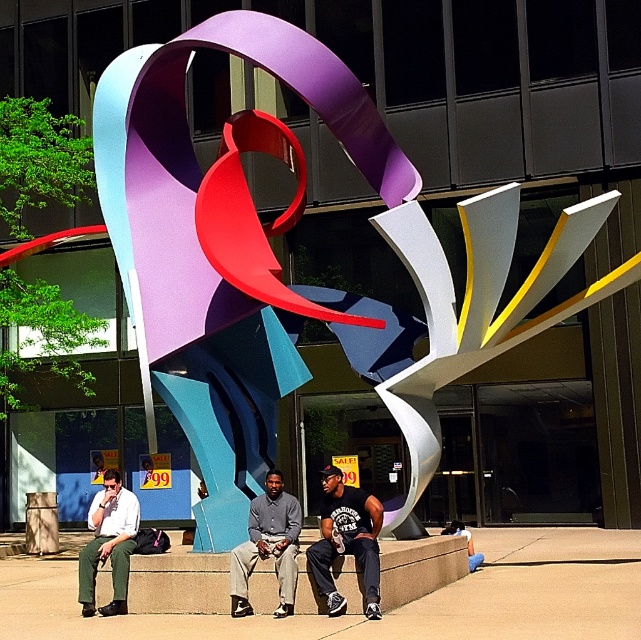
Question: Can you confirm if matte metallic abstract sculpture at center is positioned below gray shirt at center?

Choices:
 (A) no
 (B) yes

Answer: (A)

Question: Which of the following is the closest to the observer?

Choices:
 (A) [247, 525]
 (B) [178, 112]
 (C) [374, 497]

Answer: (A)

Question: Which object is positioned closest to the dark blue jeans at center?

Choices:
 (A) matte white shirt at left
 (B) matte metallic abstract sculpture at center

Answer: (A)

Question: Is matte metallic abstract sculpture at center to the left of gray shirt at center from the viewer's perspective?

Choices:
 (A) yes
 (B) no

Answer: (B)

Question: Does matte metallic abstract sculpture at center appear under gray shirt at center?

Choices:
 (A) no
 (B) yes

Answer: (A)

Question: Which object is positioned closest to the dark blue jeans at center?

Choices:
 (A) gray shirt at center
 (B) matte metallic abstract sculpture at center
 (C) matte white shirt at left

Answer: (A)